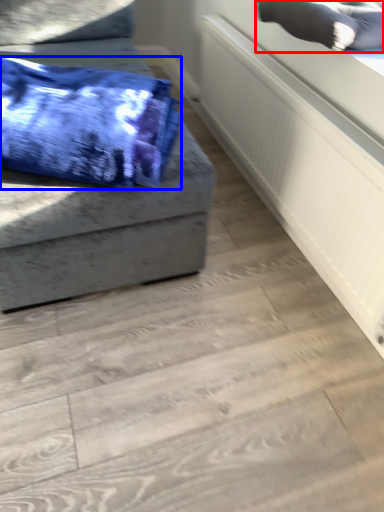
Question: Which of the following is the farthest to the observer, pillow (highlighted by a red box) or blanket (highlighted by a blue box)?

Choices:
 (A) pillow
 (B) blanket

Answer: (A)